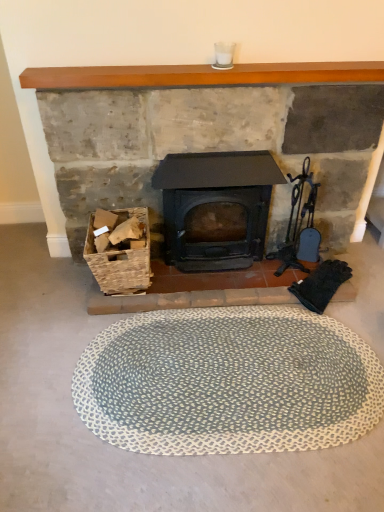
Question: From a real-world perspective, relative to matte black wood burning stove at center, is matte black stove at center vertically above or below?

Choices:
 (A) below
 (B) above

Answer: (B)

Question: Is matte black stove at center to the left or to the right of matte black wood burning stove at center in the image?

Choices:
 (A) right
 (B) left

Answer: (B)

Question: Which object is positioned closest to the matte black stove at center?

Choices:
 (A) blue textured bath mat at center
 (B) wooden mantlepiece at upper center
 (C) matte black wood burning stove at center
 (D) woven wood basket at lower left

Answer: (B)

Question: Based on their relative distances, which object is nearer to the blue textured bath mat at center?

Choices:
 (A) wooden mantlepiece at upper center
 (B) matte black stove at center
 (C) matte black wood burning stove at center
 (D) woven wood basket at lower left

Answer: (D)